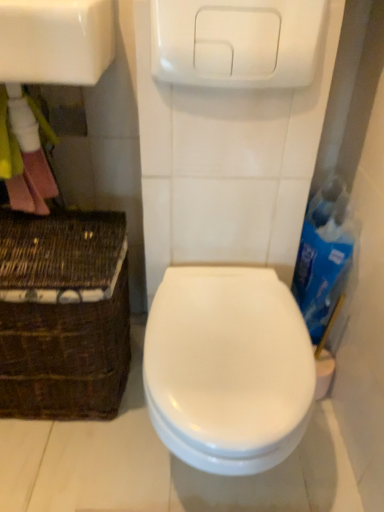
What is the approximate height of white glossy toilet at center?

white glossy toilet at center is 16.31 inches in height.

What do you see at coordinates (55, 41) in the screenshot? I see `white glossy sink at upper left` at bounding box center [55, 41].

I want to click on blue cardboard box at right, so click(324, 256).

Which is closer to the camera, (x=45, y=378) or (x=184, y=402)?

Point (x=184, y=402)

Is brown woven basket at lower left far from white glossy toilet at center?

That's not correct — brown woven basket at lower left is a little close to white glossy toilet at center.

Considering the sizes of objects brown woven basket at lower left and white glossy toilet at center in the image provided, who is wider, brown woven basket at lower left or white glossy toilet at center?

With larger width is white glossy toilet at center.

Can you tell me how much brown woven basket at lower left and white glossy toilet at center differ in facing direction?

They differ by 0.327 degrees in their facing directions.

Is brown woven basket at lower left facing towards white glossy sink at upper left?

No, brown woven basket at lower left is not turned towards white glossy sink at upper left.

Which of these two, brown woven basket at lower left or white glossy sink at upper left, is thinner?

white glossy sink at upper left is thinner.

You are a GUI agent. You are given a task and a screenshot of the screen. Output one action in this format:
    pyautogui.click(x=<x>, y=<y>)
    Task: Click on the basket that is on the left side of white glossy sink at upper left
    This screenshot has width=384, height=512.
    Given the screenshot: What is the action you would take?
    pyautogui.click(x=63, y=314)

From the image's perspective, which one is positioned higher, brown woven basket at lower left or blue cardboard box at right?

blue cardboard box at right.

Considering the relative sizes of brown woven basket at lower left and blue cardboard box at right in the image provided, is brown woven basket at lower left thinner than blue cardboard box at right?

No.

Could you tell me if brown woven basket at lower left is turned towards blue cardboard box at right?

No, brown woven basket at lower left is not oriented towards blue cardboard box at right.

Which is more to the right, brown woven basket at lower left or blue cardboard box at right?

Positioned to the right is blue cardboard box at right.

From a real-world perspective, which is physically above, white glossy toilet at center or blue cardboard box at right?

In real-world perspective, blue cardboard box at right is above.

From the image's perspective, relative to blue cardboard box at right, is white glossy toilet at center above or below?

Based on their image positions, white glossy toilet at center is located beneath blue cardboard box at right.

Is point (196, 337) closer or farther from the camera than point (302, 285)?

Point (196, 337) is positioned closer to the camera compared to point (302, 285).

Which of these two, white glossy sink at upper left or blue cardboard box at right, stands taller?

blue cardboard box at right.

Which object is positioned more to the left, white glossy sink at upper left or blue cardboard box at right?

Positioned to the left is white glossy sink at upper left.

Are white glossy sink at upper left and blue cardboard box at right beside each other?

No, white glossy sink at upper left is not next to blue cardboard box at right.

Who is bigger, white glossy sink at upper left or blue cardboard box at right?

white glossy sink at upper left is bigger.

Consider the image. Is white glossy sink at upper left inside blue cardboard box at right?

No.

How far apart are blue cardboard box at right and white glossy sink at upper left?

They are 74.89 centimeters apart.

Does point (304, 286) come closer to viewer compared to point (1, 70)?

That is False.

How many degrees apart are the facing directions of blue cardboard box at right and white glossy sink at upper left?

There is a 0.0323-degree angle between the facing directions of blue cardboard box at right and white glossy sink at upper left.

Looking at the image, does white glossy toilet at center seem bigger or smaller compared to brown woven basket at lower left?

Considering their sizes, white glossy toilet at center takes up less space than brown woven basket at lower left.

How many degrees apart are the facing directions of white glossy toilet at center and brown woven basket at lower left?

The angle between the facing direction of white glossy toilet at center and the facing direction of brown woven basket at lower left is 0.327 degrees.

Does white glossy toilet at center turn towards brown woven basket at lower left?

No, white glossy toilet at center is not facing towards brown woven basket at lower left.

This screenshot has height=512, width=384. What are the coordinates of `toilet that appears below the brown woven basket at lower left (from the image's perspective)` in the screenshot? It's located at (228, 368).

Where is `basket to the left of white glossy sink at upper left`? The image size is (384, 512). basket to the left of white glossy sink at upper left is located at coordinates click(63, 314).

From the image, which object appears to be nearer to blue cardboard box at right, white glossy sink at upper left or white glossy toilet at center?

The object closer to blue cardboard box at right is white glossy toilet at center.

From the image, which object appears to be farther from blue cardboard box at right, white glossy toilet at center or white glossy sink at upper left?

white glossy sink at upper left.

Considering their positions, is white glossy toilet at center positioned further to white glossy sink at upper left than brown woven basket at lower left?

white glossy toilet at center is further to white glossy sink at upper left.

From the image, which object appears to be nearer to blue cardboard box at right, brown woven basket at lower left or white glossy toilet at center?

Among the two, white glossy toilet at center is located nearer to blue cardboard box at right.

Which object lies further to the anchor point brown woven basket at lower left, white glossy sink at upper left or blue cardboard box at right?

blue cardboard box at right lies further to brown woven basket at lower left than the other object.

When comparing their distances from white glossy sink at upper left, does brown woven basket at lower left or blue cardboard box at right seem closer?

Among the two, brown woven basket at lower left is located nearer to white glossy sink at upper left.

From the image, which object appears to be farther from white glossy toilet at center, blue cardboard box at right or brown woven basket at lower left?

The object further to white glossy toilet at center is blue cardboard box at right.

Based on their spatial positions, is white glossy sink at upper left or brown woven basket at lower left further from white glossy toilet at center?

Based on the image, white glossy sink at upper left appears to be further to white glossy toilet at center.

Find the location of a particular element. This screenshot has height=512, width=384. basket between white glossy sink at upper left and white glossy toilet at center vertically is located at coordinates (63, 314).

Find the location of a particular element. sink situated between brown woven basket at lower left and blue cardboard box at right from left to right is located at coordinates (55, 41).

Identify the location of cleaning product between white glossy sink at upper left and white glossy toilet at center in the up-down direction. (324, 256).

Locate an element on the screen. toilet between brown woven basket at lower left and blue cardboard box at right from left to right is located at coordinates [228, 368].